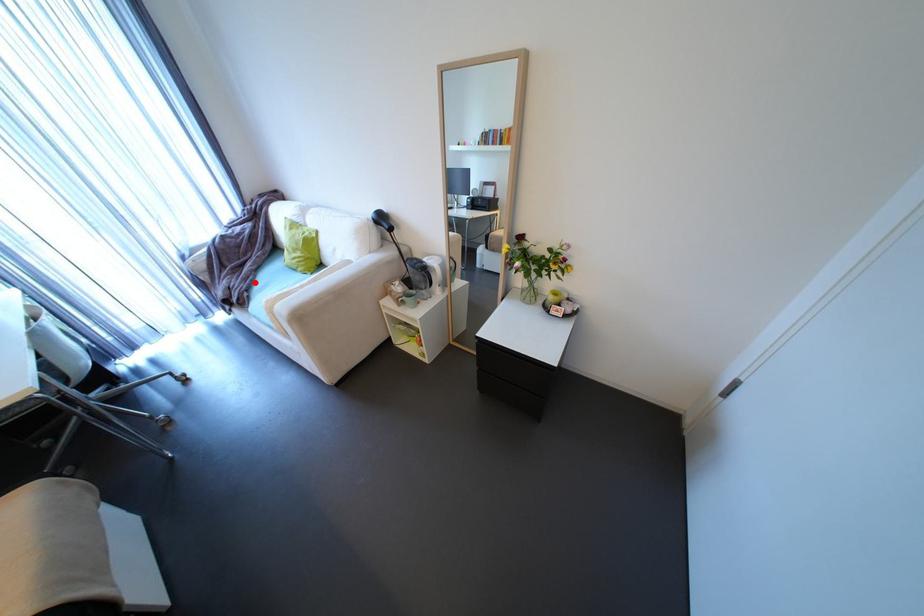
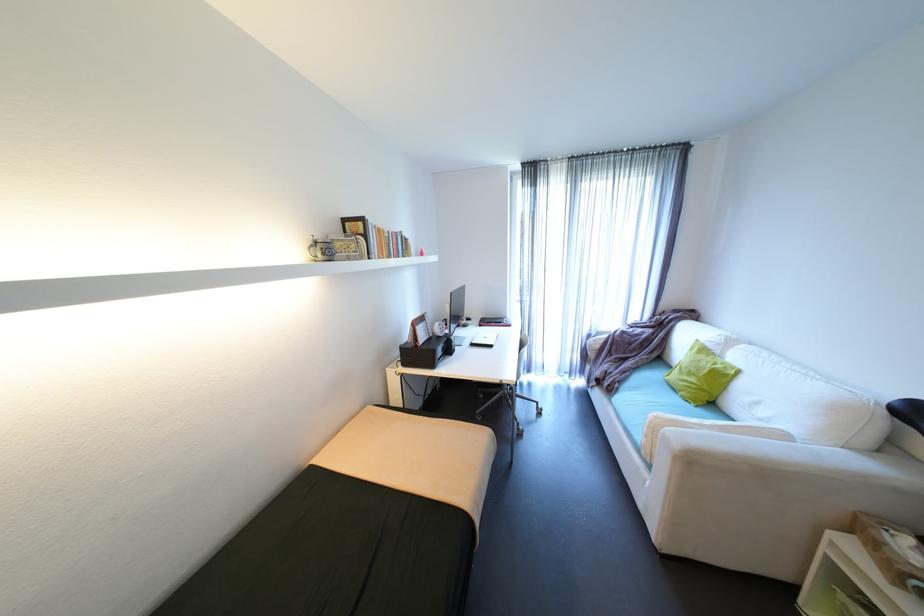
Where in the second image is the point corresponding to the highlighted location from the first image?

(630, 377)